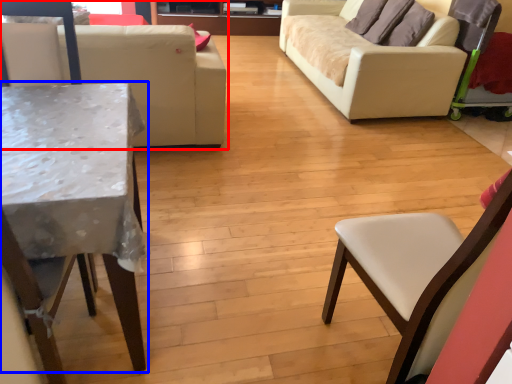
Question: Which of the following is the farthest to the observer, studio couch (highlighted by a red box) or table (highlighted by a blue box)?

Choices:
 (A) studio couch
 (B) table

Answer: (A)